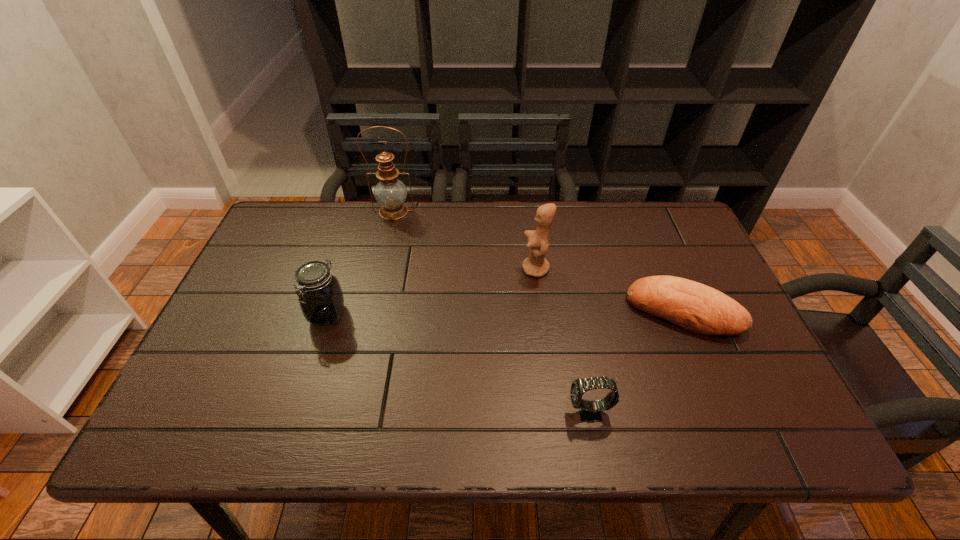
Where is `unoccupied position between the tallest object and the third tallest object`? The image size is (960, 540). unoccupied position between the tallest object and the third tallest object is located at coordinates (361, 263).

Where is `blank region between the nearest object and the tallest object`? blank region between the nearest object and the tallest object is located at coordinates (492, 312).

The height and width of the screenshot is (540, 960). Identify the location of vacant area that lies between the second shortest object and the fourth nearest object. (563, 341).

Locate an element on the screen. The height and width of the screenshot is (540, 960). unoccupied area between the second tallest object and the jar is located at coordinates (x=432, y=292).

Where is `vacant space in between the third tallest object and the bread`? vacant space in between the third tallest object and the bread is located at coordinates (505, 313).

Point out which object is positioned as the fourth nearest to the figurine. Please provide its 2D coordinates. Your answer should be formatted as a tuple, i.e. [(x, y)], where the tuple contains the x and y coordinates of a point satisfying the conditions above.

[(321, 299)]

I want to click on object that ranks as the fourth closest to the figurine, so click(x=321, y=299).

This screenshot has width=960, height=540. Find the location of `vacant position in the image that satisfies the following two spatial constraints: 1. on the front-facing side of the fourth shortest object; 2. on the lid of the third tallest object`. vacant position in the image that satisfies the following two spatial constraints: 1. on the front-facing side of the fourth shortest object; 2. on the lid of the third tallest object is located at coordinates (541, 314).